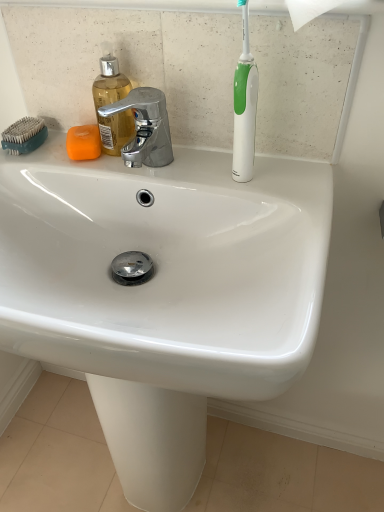
At what (x,y) coordinates should I click in order to perform the action: click on empty space that is to the right of translucent plastic soap dispenser at upper left. Please return your answer as a coordinate pair (x, y). Looking at the image, I should click on (231, 170).